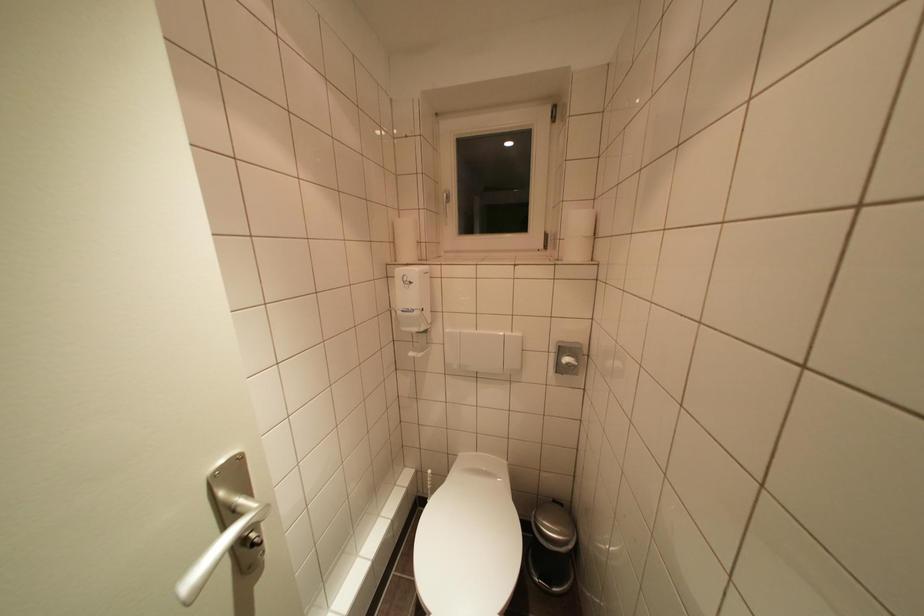
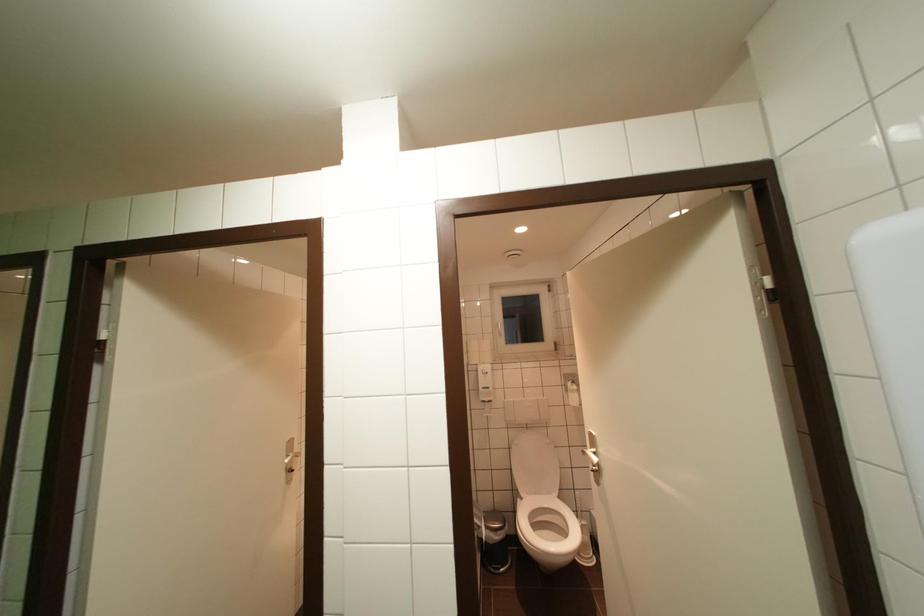
In a continuous first-person perspective shot, in which direction is the camera moving?

The cameraman walked toward right, backward.